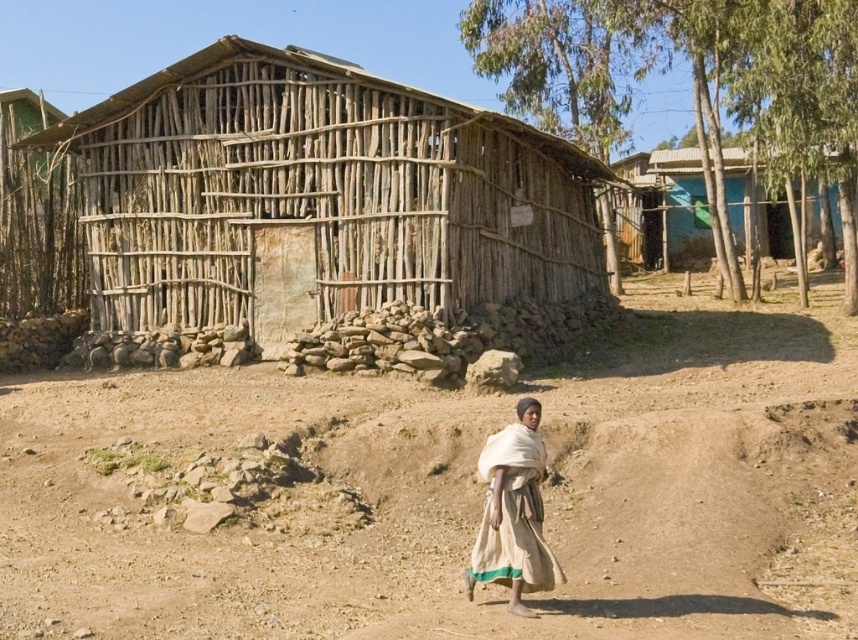
You are standing at the point with coordinates (317, 195). Based on the scene description, what structure are you directly in front of?

The point (317, 195) corresponds to the natural wood hut at center, so you are directly in front of the natural wood hut at center.